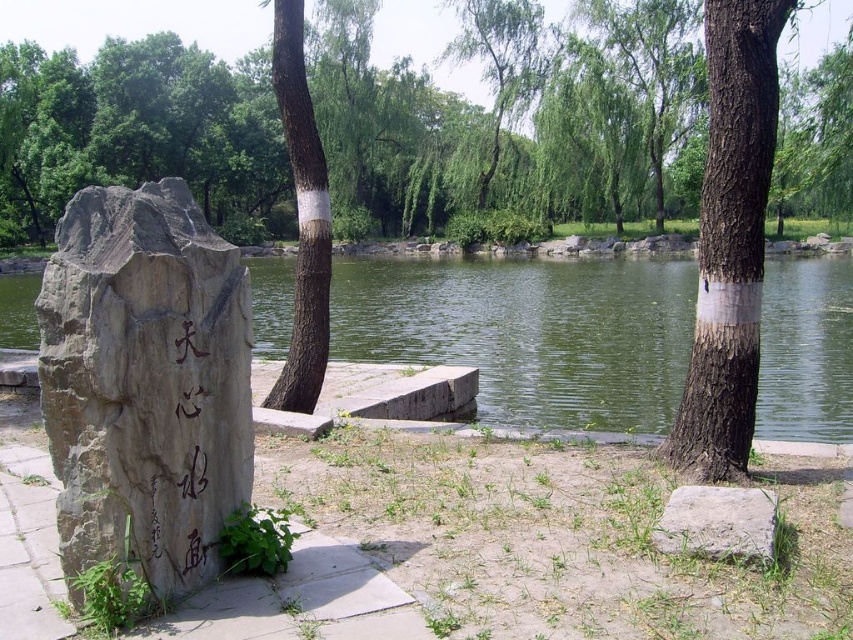
Which is more to the left, brown rough bark tree at right or brown rough bark tree at center?

brown rough bark tree at center

Between brown rough bark tree at right and brown rough bark tree at center, which one is positioned higher?

brown rough bark tree at center

Is point (721, 316) behind point (306, 241)?

No, it is not.

Find the location of a particular element. Image resolution: width=853 pixels, height=640 pixels. brown rough bark tree at right is located at coordinates (730, 241).

Is brown rough bark tree at right to the left of gray rough stone at lower right from the viewer's perspective?

In fact, brown rough bark tree at right is to the right of gray rough stone at lower right.

Is point (717, 445) less distant than point (691, 492)?

No.

Is point (759, 150) closer to viewer compared to point (741, 502)?

No, it is behind (741, 502).

Locate an element on the screen. The image size is (853, 640). brown rough bark tree at right is located at coordinates (730, 241).

Between point (741, 116) and point (531, 29), which one is positioned behind?

The point (531, 29) is more distant.

Measure the distance from brown rough bark tree at right to green leafy tree at upper center.

brown rough bark tree at right is 56.58 meters away from green leafy tree at upper center.

Is point (730, 70) positioned after point (509, 51)?

No, (730, 70) is in front of (509, 51).

Where is `brown rough bark tree at right`? The height and width of the screenshot is (640, 853). brown rough bark tree at right is located at coordinates (730, 241).